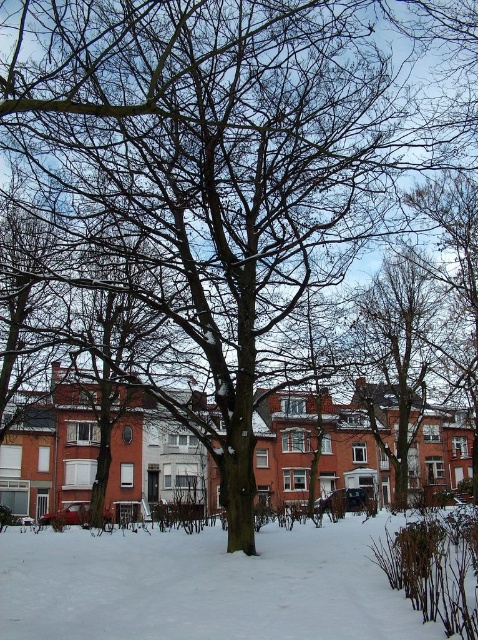
You are a photographer standing at the edge of the snow area. You want to take a photo of the bare branches at upper center while including the white powdery snow at lower center in the frame. Given the distance between them, will you be able to capture both in a single shot with a standard zoom lens?

The white powdery snow at lower center is 50.38 meters from the bare branches at upper center. With a standard zoom lens, which typically has a field of view that can capture objects within a reasonable distance apart, you should be able to include both the white powdery snow at lower center and the bare branches at upper center in a single shot.